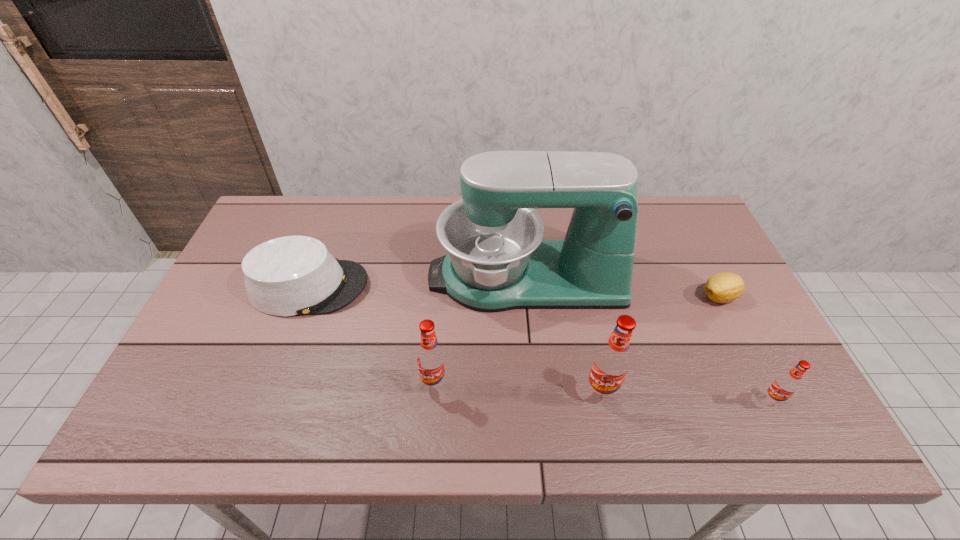
The width and height of the screenshot is (960, 540). I want to click on vacant spot to place a root beer on the left, so click(x=274, y=376).